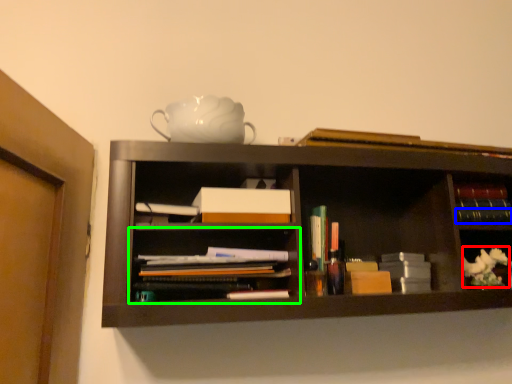
Question: Which is nearer to the flower (highlighted by a red box)? book (highlighted by a blue box) or shelf (highlighted by a green box).

Choices:
 (A) book
 (B) shelf

Answer: (A)